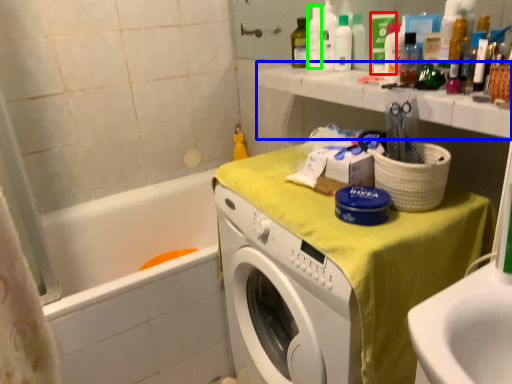
Question: Based on their relative distances, which object is farther from toiletry (highlighted by a red box)? Choose from counter top (highlighted by a blue box) and bottle (highlighted by a green box).

Choices:
 (A) counter top
 (B) bottle

Answer: (A)